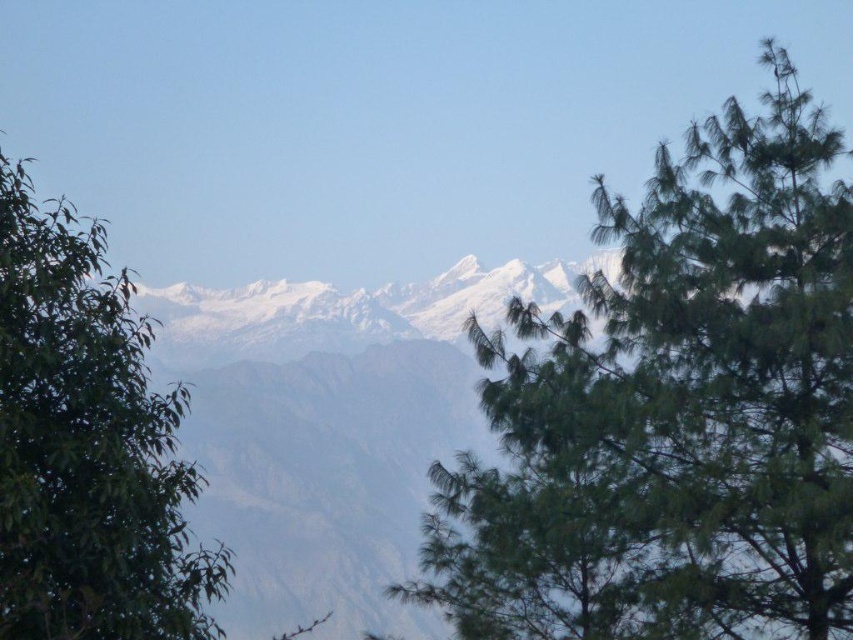
Question: Which object appears farthest from the camera in this image?

Choices:
 (A) green needle-like tree at center
 (B) green leafy tree at left

Answer: (A)

Question: Among these objects, which one is farthest from the camera?

Choices:
 (A) green needle-like tree at center
 (B) green leafy tree at left

Answer: (A)

Question: Is green needle-like tree at center smaller than green leafy tree at left?

Choices:
 (A) no
 (B) yes

Answer: (B)

Question: Is green needle-like tree at center bigger than green leafy tree at left?

Choices:
 (A) no
 (B) yes

Answer: (A)

Question: Can you confirm if green needle-like tree at center is positioned to the right of green leafy tree at left?

Choices:
 (A) yes
 (B) no

Answer: (A)